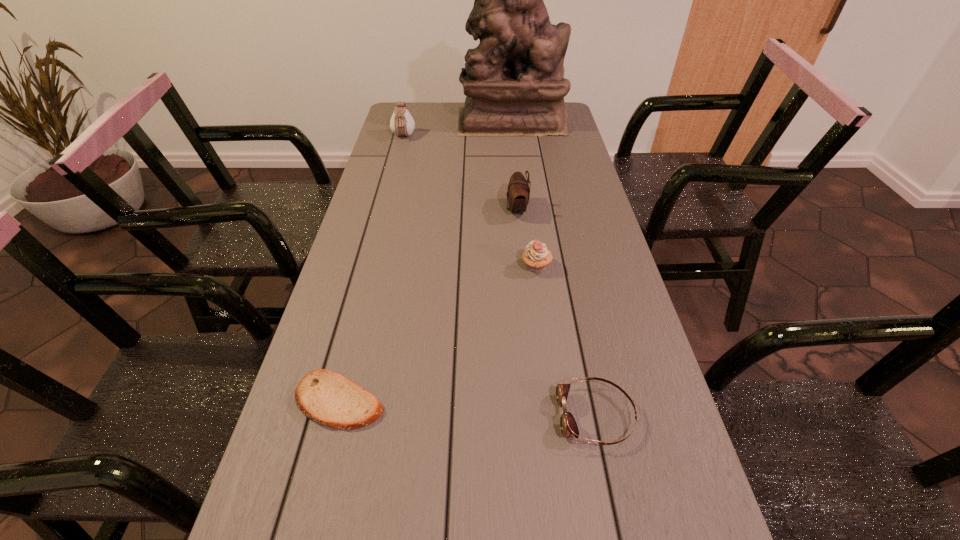
Identify the location of the tallest object. (514, 81).

The width and height of the screenshot is (960, 540). I want to click on the left pouch, so click(x=401, y=123).

Locate an element on the screen. The image size is (960, 540). the nearer pouch is located at coordinates (518, 192).

The height and width of the screenshot is (540, 960). I want to click on the right pouch, so click(518, 192).

Where is `the fourth tallest object`? the fourth tallest object is located at coordinates (536, 256).

At what (x,y) coordinates should I click in order to perform the action: click on cupcake. Please return your answer as a coordinate pair (x, y). The width and height of the screenshot is (960, 540). Looking at the image, I should click on (536, 256).

Identify the location of goggles. This screenshot has width=960, height=540. (568, 425).

At what (x,y) coordinates should I click in order to perform the action: click on the shortest object. Please return your answer as a coordinate pair (x, y). The height and width of the screenshot is (540, 960). Looking at the image, I should click on click(x=328, y=398).

Locate an element on the screen. The image size is (960, 540). vacant area located 0.120m on the front-facing side of the tallest object is located at coordinates (428, 121).

The width and height of the screenshot is (960, 540). In order to click on free point located on the front-facing side of the tallest object in this screenshot , I will do `click(431, 121)`.